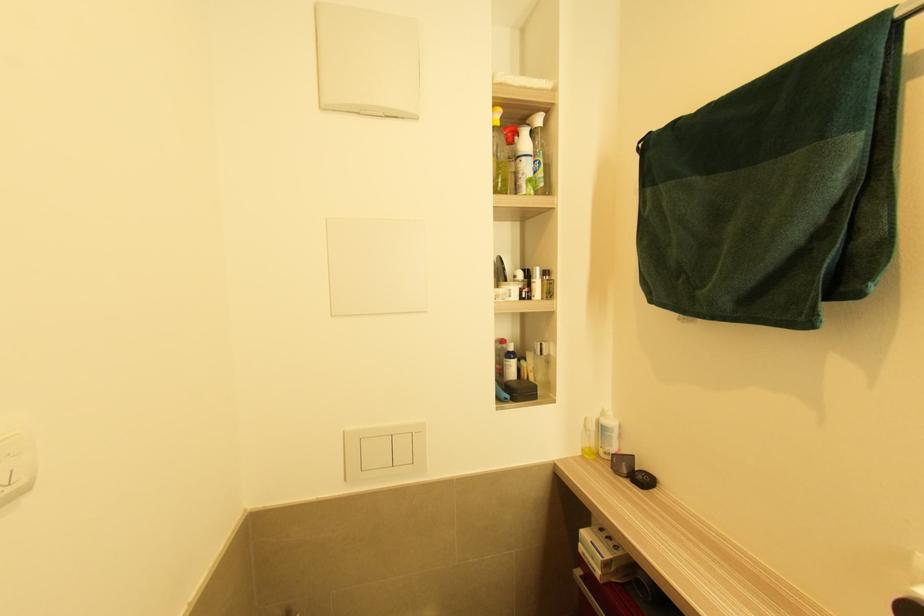
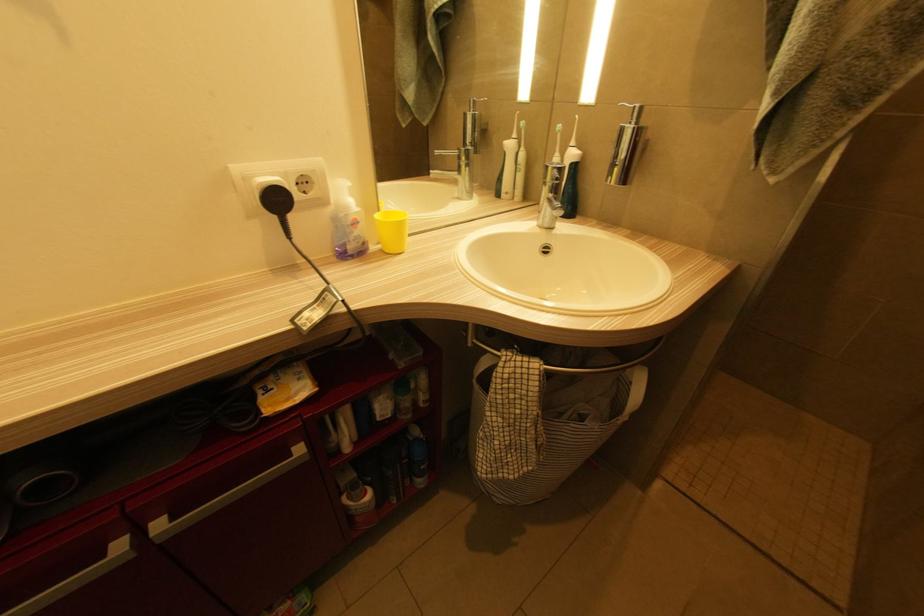
The images are taken continuously from a first-person perspective. In which direction is your viewpoint rotating?

The camera rotated toward right-down.